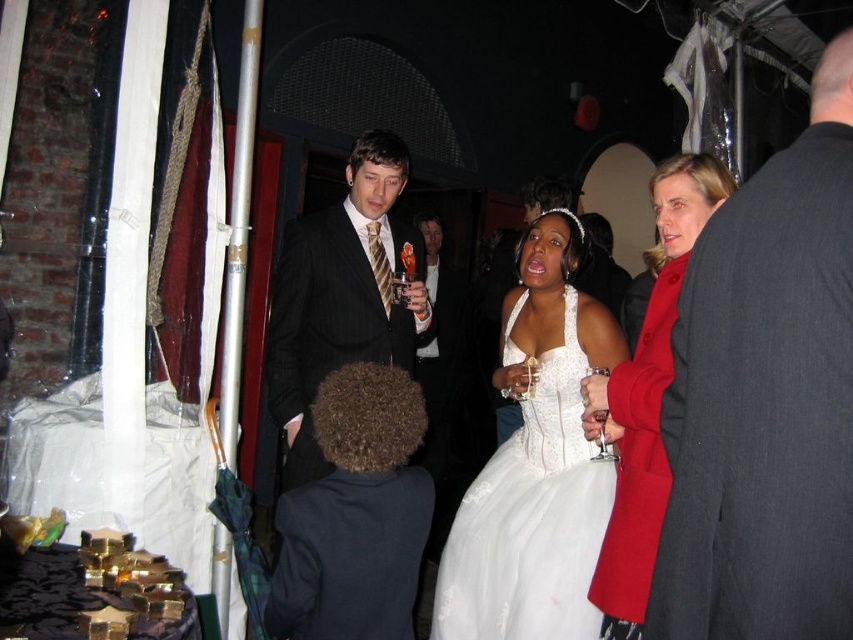
Question: Which is nearer to the dark brown curly hair at center?

Choices:
 (A) matte red coat at right
 (B) white lace dress at center
 (C) pinstripe suit at center

Answer: (A)

Question: Does dark brown curly hair at center have a larger size compared to pinstripe suit at center?

Choices:
 (A) no
 (B) yes

Answer: (A)

Question: Observing the image, what is the correct spatial positioning of white lace dress at center in reference to pinstripe suit at center?

Choices:
 (A) below
 (B) above

Answer: (A)

Question: Which of the following is the farthest from the observer?

Choices:
 (A) white lace dress at center
 (B) dark gray suit at right
 (C) matte red coat at right
 (D) pinstripe suit at center

Answer: (D)

Question: Which is farther from the dark brown curly hair at center?

Choices:
 (A) white lace dress at center
 (B) matte red coat at right
 (C) pinstripe suit at center

Answer: (C)

Question: Does dark brown curly hair at center appear on the left side of pinstripe suit at center?

Choices:
 (A) yes
 (B) no

Answer: (B)